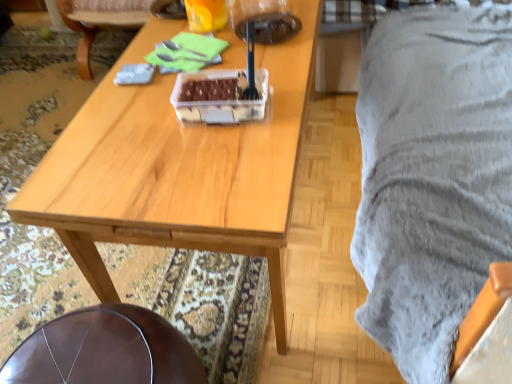
The width and height of the screenshot is (512, 384). What are the coordinates of `vacant space underneath translucent plastic container at center (from a real-world perspective)` in the screenshot? It's located at (242, 112).